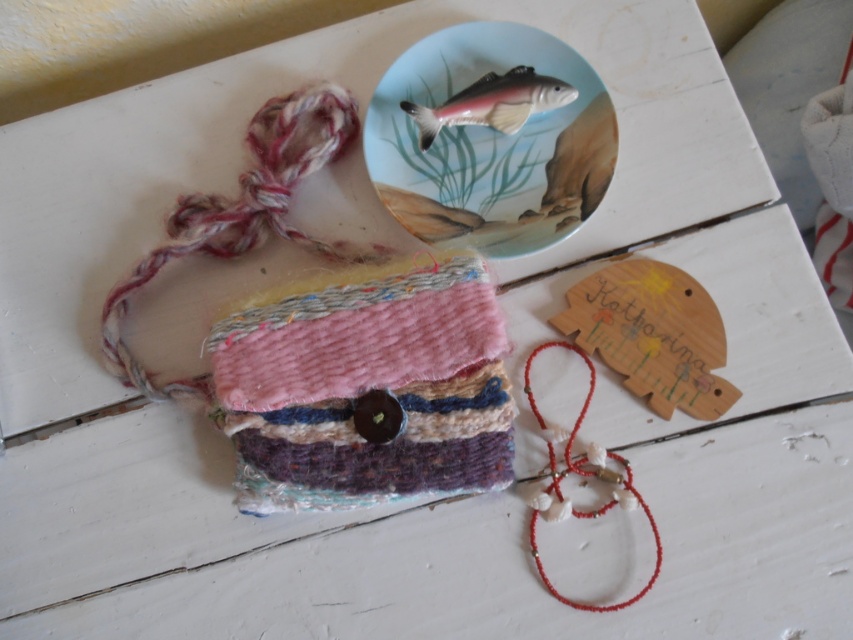
Question: Which point is farther to the camera?

Choices:
 (A) textured wool pouch at center
 (B) porcelain fish plate at upper center
 (C) shiny metallic fish at upper center

Answer: (C)

Question: Based on their relative distances, which object is farther from the shiny metallic fish at upper center?

Choices:
 (A) red beaded string at lower right
 (B) porcelain fish plate at upper center

Answer: (A)

Question: Estimate the real-world distances between objects in this image. Which object is closer to the porcelain fish plate at upper center?

Choices:
 (A) textured wool pouch at center
 (B) shiny metallic fish at upper center
 (C) red beaded string at lower right

Answer: (B)

Question: Can you confirm if textured wool pouch at center is positioned above red beaded string at lower right?

Choices:
 (A) no
 (B) yes

Answer: (B)

Question: Does textured wool pouch at center have a greater width compared to shiny metallic fish at upper center?

Choices:
 (A) yes
 (B) no

Answer: (A)

Question: Does shiny metallic fish at upper center appear over red beaded string at lower right?

Choices:
 (A) yes
 (B) no

Answer: (A)